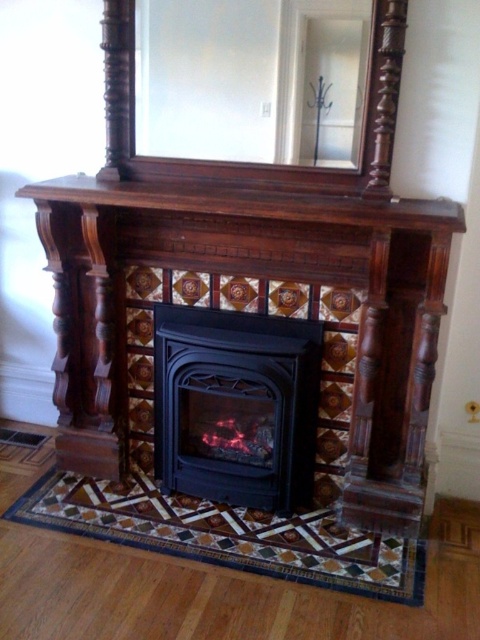
Which is in front, point (303, 38) or point (184, 180)?

Point (303, 38)

Does clear glass mirror at upper center have a lesser width compared to dark wood/marble fireplace mantel at upper center?

Yes.

This screenshot has width=480, height=640. What do you see at coordinates (250, 77) in the screenshot?
I see `clear glass mirror at upper center` at bounding box center [250, 77].

At what (x,y) coordinates should I click in order to perform the action: click on clear glass mirror at upper center. Please return your answer as a coordinate pair (x, y). The height and width of the screenshot is (640, 480). Looking at the image, I should click on (250, 77).

Is clear glass mirror at upper center smaller than black matte fireplace at center?

Indeed, clear glass mirror at upper center has a smaller size compared to black matte fireplace at center.

Is point (284, 52) less distant than point (235, 438)?

Yes.

The image size is (480, 640). In order to click on clear glass mirror at upper center in this screenshot , I will do `click(250, 77)`.

Is point (163, 321) closer to viewer compared to point (236, 189)?

That is False.

Is point (240, 499) positioned after point (312, 220)?

That is True.

This screenshot has height=640, width=480. Describe the element at coordinates (236, 404) in the screenshot. I see `black matte fireplace at center` at that location.

Where is `black matte fireplace at center`? The width and height of the screenshot is (480, 640). black matte fireplace at center is located at coordinates (236, 404).